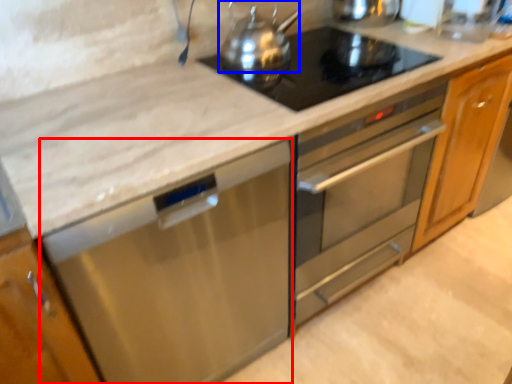
Question: Among these objects, which one is farthest to the camera, dish washer (highlighted by a red box) or kitchen appliance (highlighted by a blue box)?

Choices:
 (A) dish washer
 (B) kitchen appliance

Answer: (B)